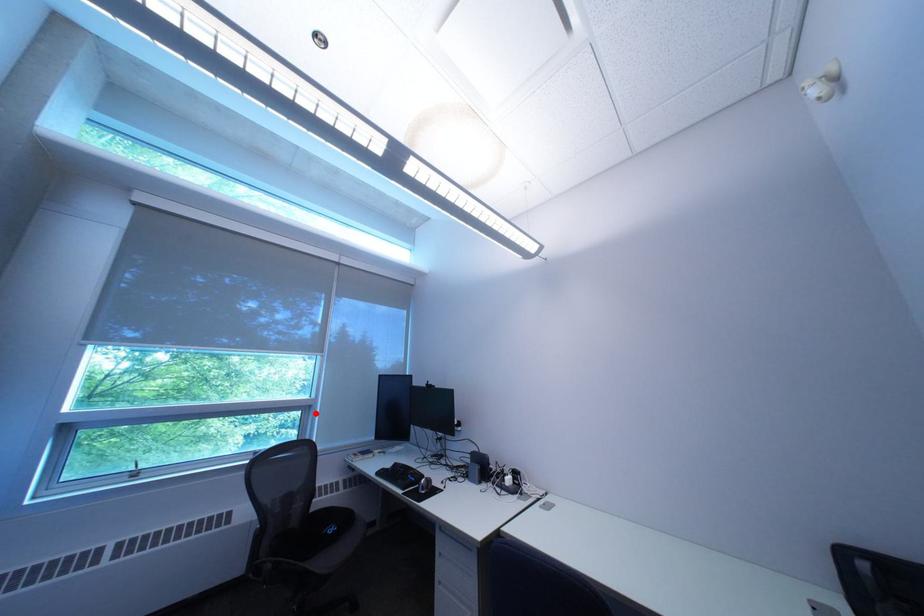
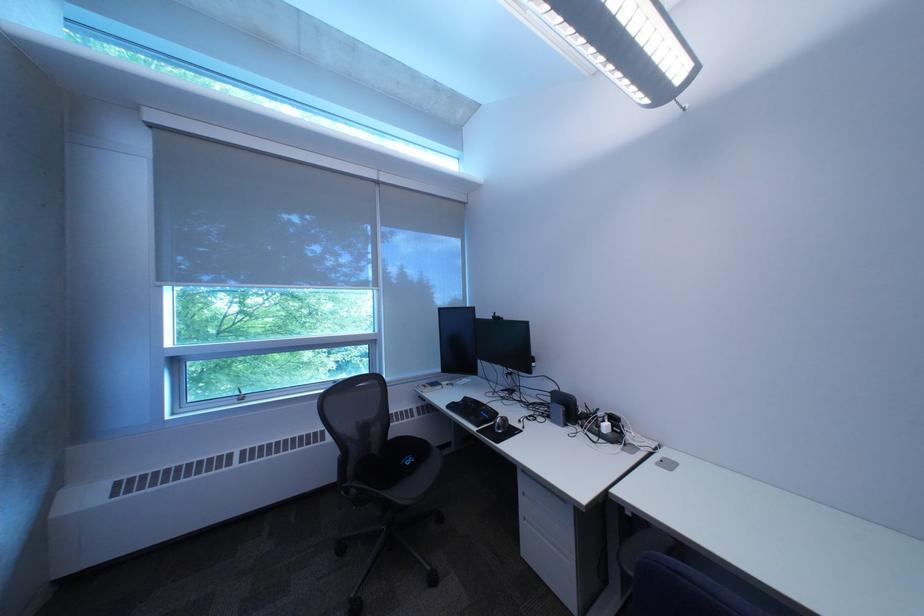
Question: I am providing you with two images of the same scene from different viewpoints. In image1, a red point is highlighted. Considering the same 3D point in image2, which of the following is correct?

Choices:
 (A) It is closer
 (B) It is farther

Answer: (A)